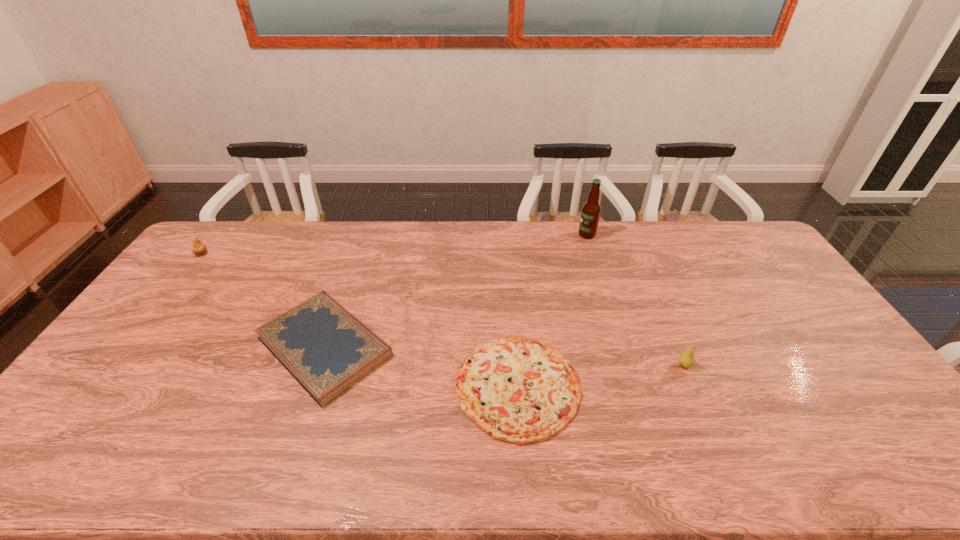
The width and height of the screenshot is (960, 540). Find the location of `the second object from right to left`. the second object from right to left is located at coordinates (591, 210).

Locate an element on the screen. This screenshot has height=540, width=960. beer bottle is located at coordinates (591, 210).

Find the location of a particular element. the farther pear is located at coordinates (198, 248).

Find the location of a particular element. The height and width of the screenshot is (540, 960). the left pear is located at coordinates (198, 248).

Locate an element on the screen. The image size is (960, 540). the nearer pear is located at coordinates (686, 358).

Where is `the rightmost object`? The image size is (960, 540). the rightmost object is located at coordinates (686, 358).

This screenshot has width=960, height=540. In order to click on the fourth object from right to left in this screenshot , I will do `click(321, 344)`.

This screenshot has height=540, width=960. Find the location of `the second shortest object`. the second shortest object is located at coordinates (321, 344).

Locate an element on the screen. the third object from left to right is located at coordinates (517, 389).

Find the location of a particular element. This screenshot has height=540, width=960. pizza is located at coordinates (517, 389).